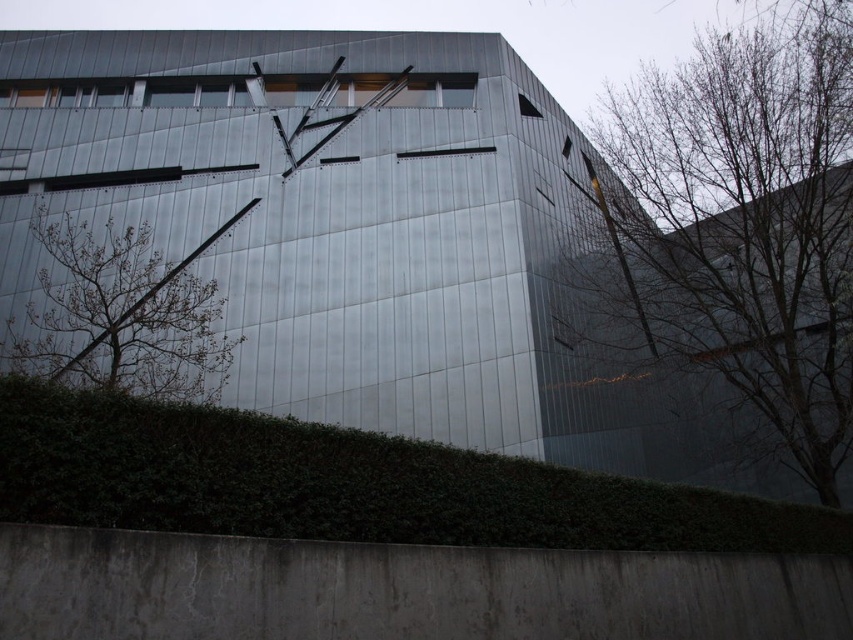
Can you confirm if green leafy hedge at lower center is positioned to the left of bare branches at left?

In fact, green leafy hedge at lower center is to the right of bare branches at left.

Based on the photo, is green leafy hedge at lower center wider than bare branches at left?

No, green leafy hedge at lower center is not wider than bare branches at left.

Is point (154, 476) farther from viewer compared to point (163, 372)?

No.

This screenshot has width=853, height=640. Find the location of `green leafy hedge at lower center`. green leafy hedge at lower center is located at coordinates (347, 484).

Which is more to the left, bare branches at right or green leafy hedge at lower center?

green leafy hedge at lower center

Which of these two, bare branches at right or green leafy hedge at lower center, stands taller?

Standing taller between the two is bare branches at right.

Where is `bare branches at right`? The image size is (853, 640). bare branches at right is located at coordinates (743, 224).

Does bare branches at right appear on the right side of bare branches at left?

Correct, you'll find bare branches at right to the right of bare branches at left.

Between point (692, 275) and point (152, 312), which one is positioned behind?

The point (692, 275) is more distant.

Locate an element on the screen. This screenshot has height=640, width=853. bare branches at right is located at coordinates (743, 224).

What are the coordinates of `bare branches at right` in the screenshot? It's located at (743, 224).